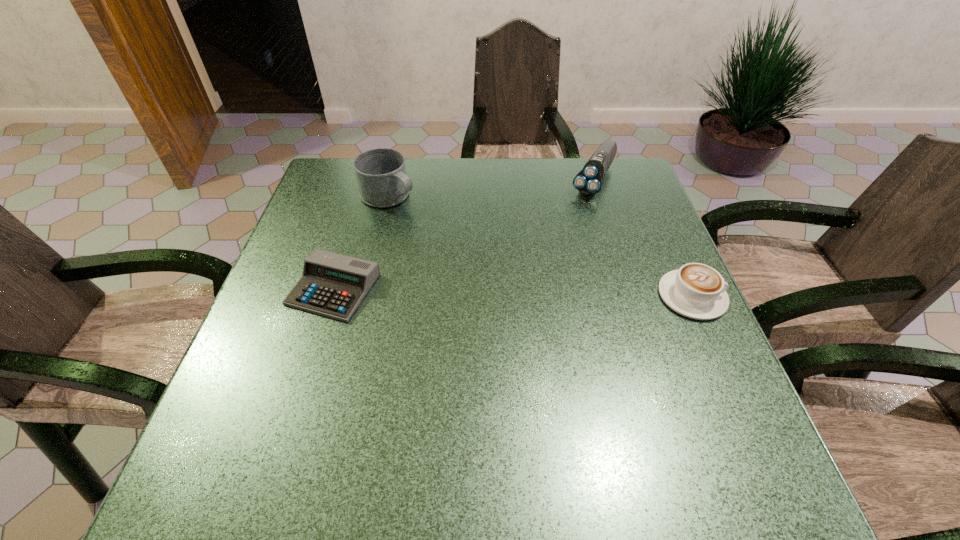
This screenshot has width=960, height=540. I want to click on free point between the shortest object and the tallest object, so click(x=361, y=242).

Locate an element on the screen. This screenshot has width=960, height=540. free area in between the electric shaver and the calculator is located at coordinates (464, 234).

Locate an element on the screen. free space between the cappuccino and the electric shaver is located at coordinates (643, 237).

Image resolution: width=960 pixels, height=540 pixels. I want to click on unoccupied area between the third shortest object and the mug, so click(x=492, y=187).

This screenshot has height=540, width=960. Find the location of `free space between the calculator and the second tallest object`. free space between the calculator and the second tallest object is located at coordinates (464, 234).

I want to click on object that is the closest to the shortest object, so click(x=381, y=174).

Point out which object is positioned as the second nearest to the calculator. Please provide its 2D coordinates. Your answer should be formatted as a tuple, i.e. [(x, y)], where the tuple contains the x and y coordinates of a point satisfying the conditions above.

[(588, 181)]

The image size is (960, 540). Identify the location of free space that satisfies the following two spatial constraints: 1. on the front side of the cappuccino; 2. with the handle on the right side of the calculator. (331, 296).

You are a GUI agent. You are given a task and a screenshot of the screen. Output one action in this format:
    pyautogui.click(x=<x>, y=<y>)
    Task: Click on the vacant space that satisfies the following two spatial constraints: 1. on the back side of the mug; 2. on the left side of the third shortest object
    The height and width of the screenshot is (540, 960).
    Given the screenshot: What is the action you would take?
    pyautogui.click(x=394, y=178)

Where is `vacant region that satisfies the following two spatial constraints: 1. on the back side of the second tallest object; 2. on the left side of the mug`? This screenshot has width=960, height=540. vacant region that satisfies the following two spatial constraints: 1. on the back side of the second tallest object; 2. on the left side of the mug is located at coordinates (394, 178).